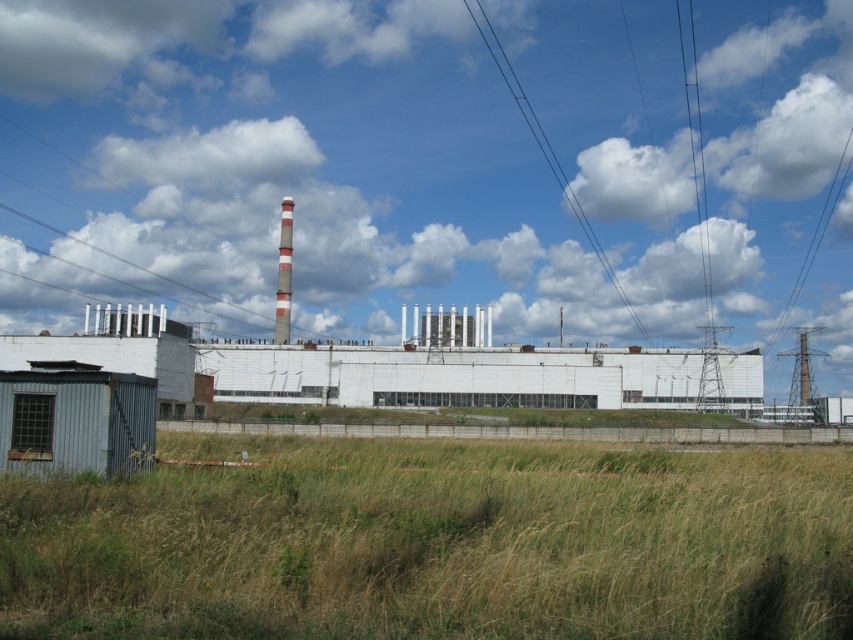
You are a maintenance worker needing to inspect the black wire at upper center and the camera. How far apart are these two items?

The black wire at upper center and the camera are 657.80 feet apart from each other.

You are a drone operator trying to capture a photo of the industrial building. The drone is currently at the white fluffy cloud at upper center. To get the best shot, you need to move the drone 0.1 units to the right. Where will the drone be positioned relative to the industrial building?

The white fluffy cloud at upper center is at point (431, 164). Moving 0.1 units to the right would place the drone at approximately 0.359 on the x axis. Since the industrial building is in the midground, the drone would now be positioned to the right of the industrial building.